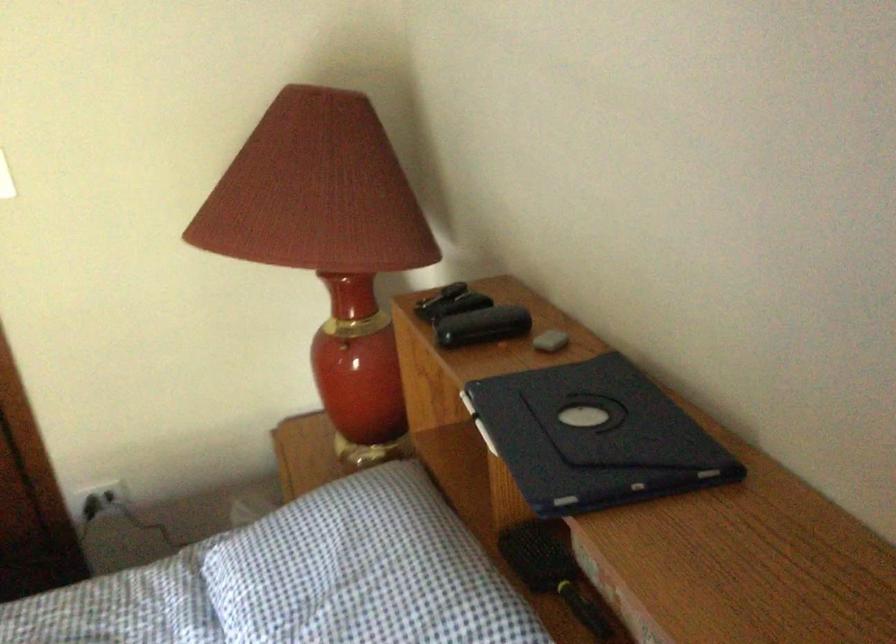
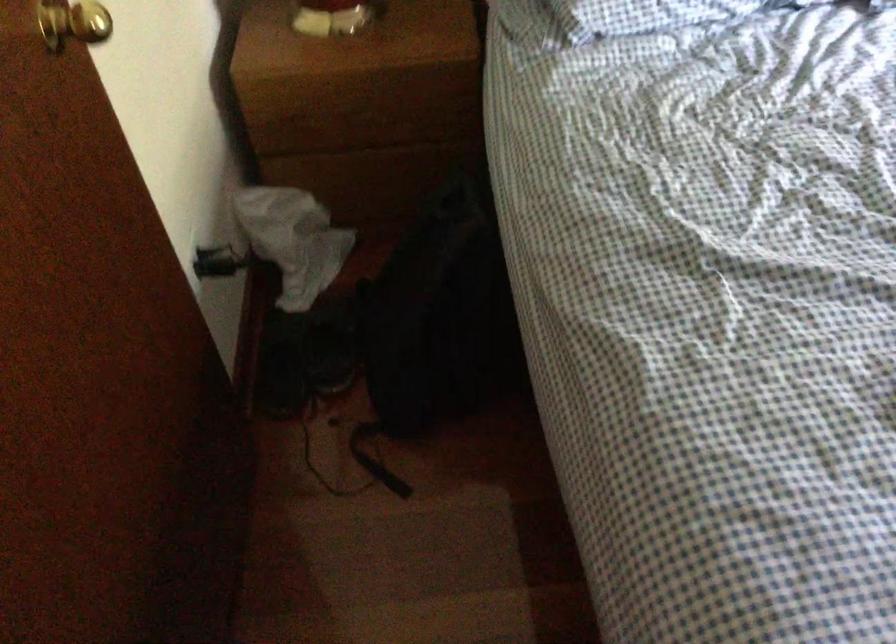
Question: I am providing you with two images of the same scene from different viewpoints. Please identify which objects are invisible in image2.

Choices:
 (A) small brown pot
 (B) black backpack
 (C) black shoe
 (D) wall outlet

Answer: (D)